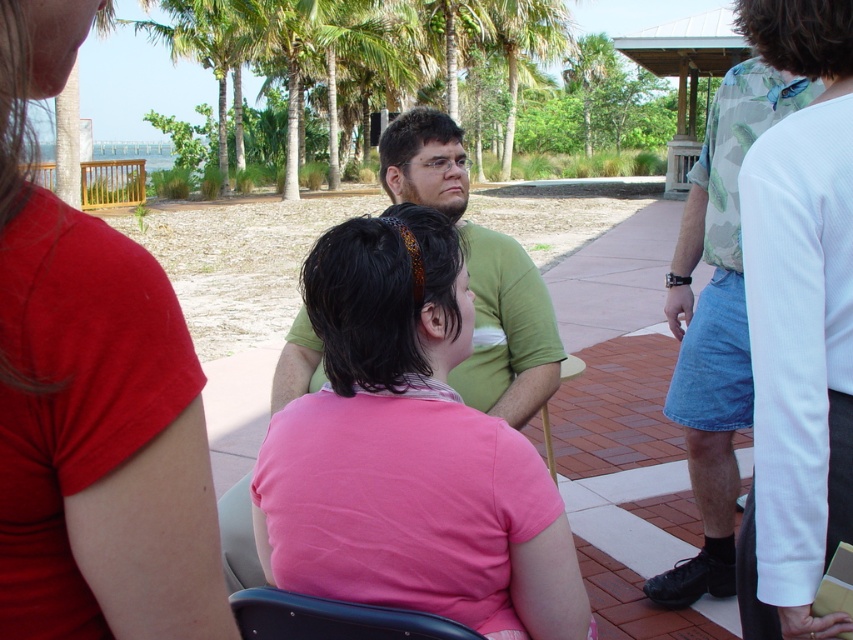
Question: Can you confirm if white textured shirt at upper right is thinner than black plastic chair at lower center?

Choices:
 (A) no
 (B) yes

Answer: (B)

Question: Among these points, which one is nearest to the camera?

Choices:
 (A) (80, 497)
 (B) (306, 620)
 (C) (741, 611)

Answer: (A)

Question: Is white textured shirt at upper right bigger than matte pink shirt at center?

Choices:
 (A) yes
 (B) no

Answer: (A)

Question: Which object is positioned farthest from the black plastic chair at lower center?

Choices:
 (A) camouflage shirt at right
 (B) pink fabric shirt at center
 (C) green matte shirt at center
 (D) matte pink shirt at center

Answer: (A)

Question: Can you confirm if matte pink shirt at center is positioned to the left of camouflage shirt at right?

Choices:
 (A) no
 (B) yes

Answer: (B)

Question: Which point is closer to the camera taking this photo?

Choices:
 (A) (645, 584)
 (B) (845, 147)

Answer: (B)